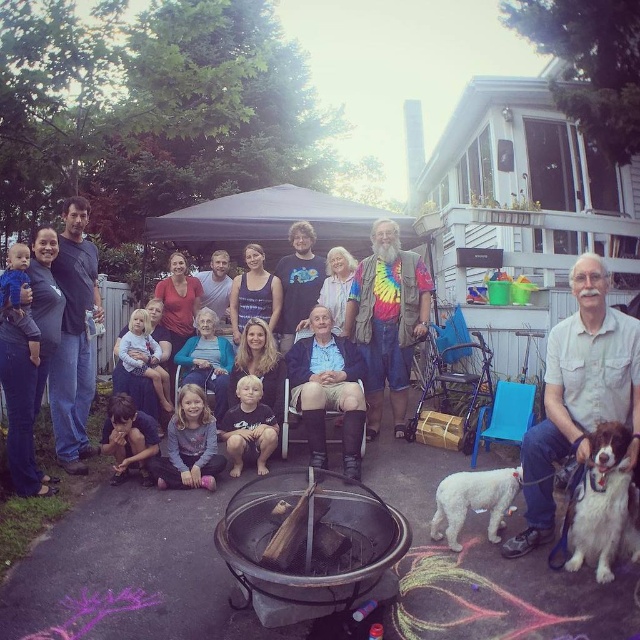
Who is higher up, white shirt at center or blue fabric shirt at center?

white shirt at center is above.

Is white shirt at center positioned in front of blue fabric shirt at center?

That is True.

Where is `white shirt at center`? white shirt at center is located at coordinates (579, 396).

Who is positioned more to the right, blue fabric shirt at center or gray fleece jacket at lower center?

From the viewer's perspective, blue fabric shirt at center appears more on the right side.

In the scene shown: Is blue fabric shirt at center smaller than gray fleece jacket at lower center?

Actually, blue fabric shirt at center might be larger than gray fleece jacket at lower center.

Which is behind, point (301, 403) or point (177, 396)?

Point (177, 396)

Locate an element on the screen. blue fabric shirt at center is located at coordinates pos(326,388).

Does white shirt at center have a larger size compared to gray fleece jacket at lower center?

Yes, white shirt at center is bigger than gray fleece jacket at lower center.

Image resolution: width=640 pixels, height=640 pixels. I want to click on white shirt at center, so click(x=579, y=396).